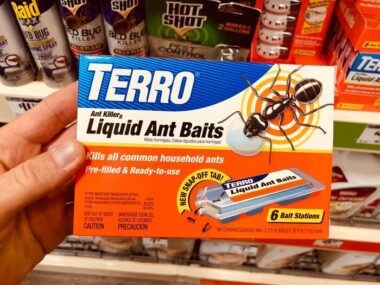
At what (x,y) coordinates should I click in order to perform the action: click on green shelf front ledge top shelf. Please return your answer as a coordinate pair (x, y). This screenshot has height=285, width=380. Looking at the image, I should click on (347, 132).